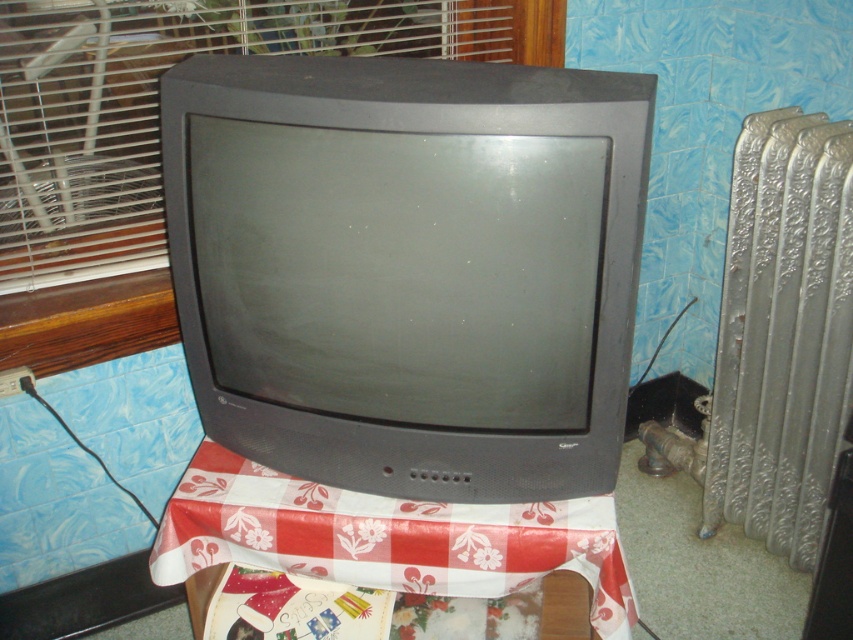
Does silver textured radiator at right have a greater height compared to plastic wrapping paper at center?

Yes, silver textured radiator at right is taller than plastic wrapping paper at center.

Does silver textured radiator at right appear on the right side of plastic wrapping paper at center?

Indeed, silver textured radiator at right is positioned on the right side of plastic wrapping paper at center.

Image resolution: width=853 pixels, height=640 pixels. Identify the location of silver textured radiator at right. (782, 336).